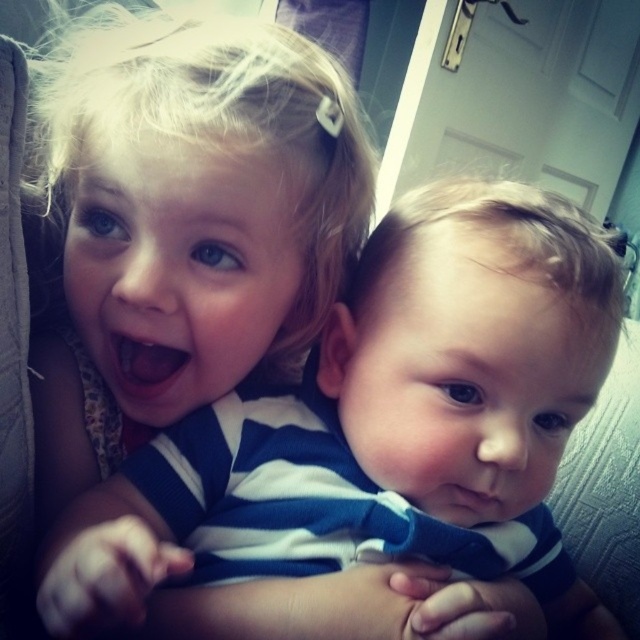
Does point (116, 52) come in front of point (154, 387)?

Yes, it is.

Does blonde hair at upper left have a smaller size compared to bright pink flesh at center?

Incorrect, blonde hair at upper left is not smaller in size than bright pink flesh at center.

This screenshot has height=640, width=640. I want to click on blonde hair at upper left, so click(x=189, y=220).

Does blue striped shirt at center have a lesser height compared to bright pink flesh at center?

Incorrect, blue striped shirt at center's height does not fall short of bright pink flesh at center's.

Is blue striped shirt at center positioned before bright pink flesh at center?

Yes, it is in front of bright pink flesh at center.

Where is `blue striped shirt at center`? Image resolution: width=640 pixels, height=640 pixels. blue striped shirt at center is located at coordinates (384, 422).

Where is `blue striped shirt at center`? The image size is (640, 640). blue striped shirt at center is located at coordinates 384,422.

Does point (269, 502) lie behind point (224, 220)?

That is True.

Locate an element on the screen. The image size is (640, 640). blue striped shirt at center is located at coordinates (384, 422).